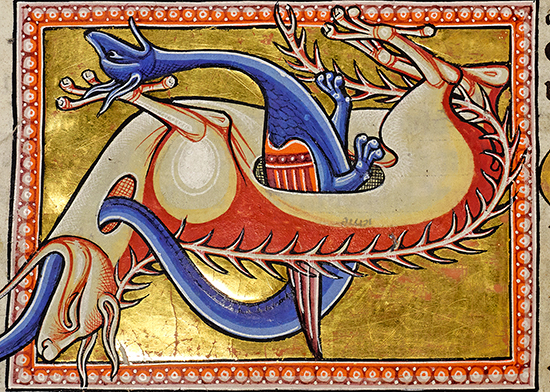
The width and height of the screenshot is (550, 392). What are the coordinates of `small red cracks in rug` in the screenshot? It's located at (174, 326), (231, 348), (276, 354), (201, 344), (155, 352).